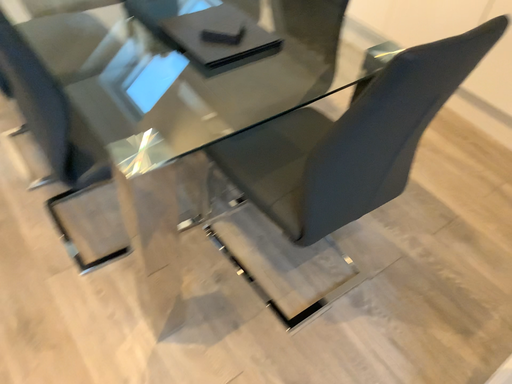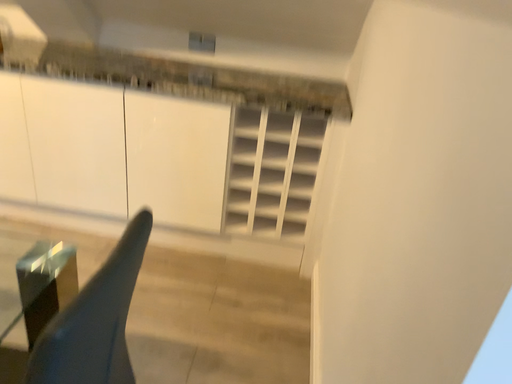
Question: How did the camera likely rotate when shooting the video?

Choices:
 (A) rotated right
 (B) rotated left

Answer: (A)